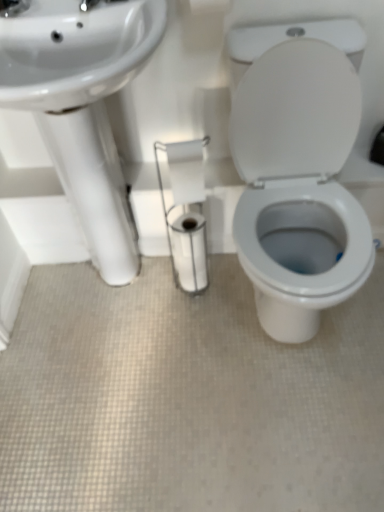
Locate an element on the screen. The width and height of the screenshot is (384, 512). vacant region in front of white glossy porcelain at center is located at coordinates (279, 422).